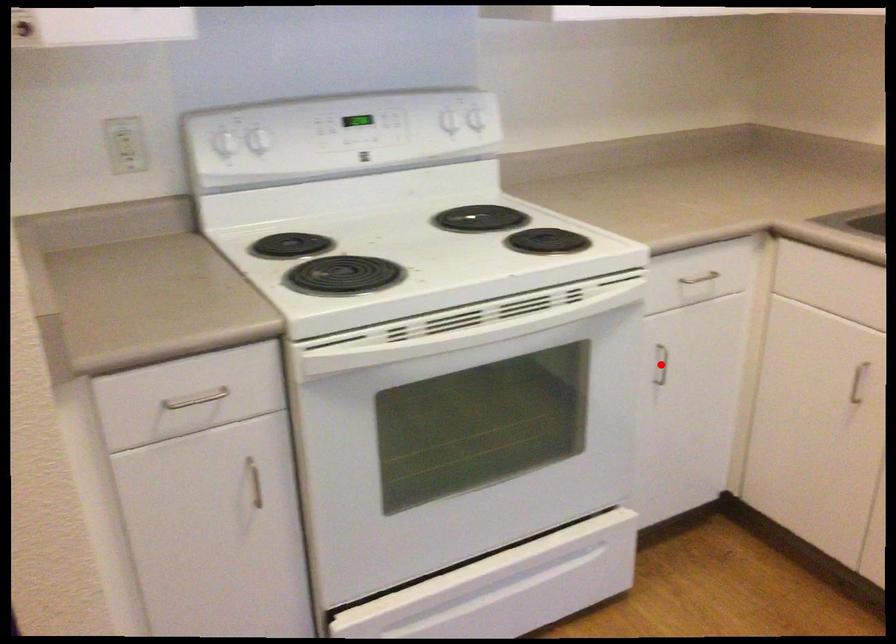
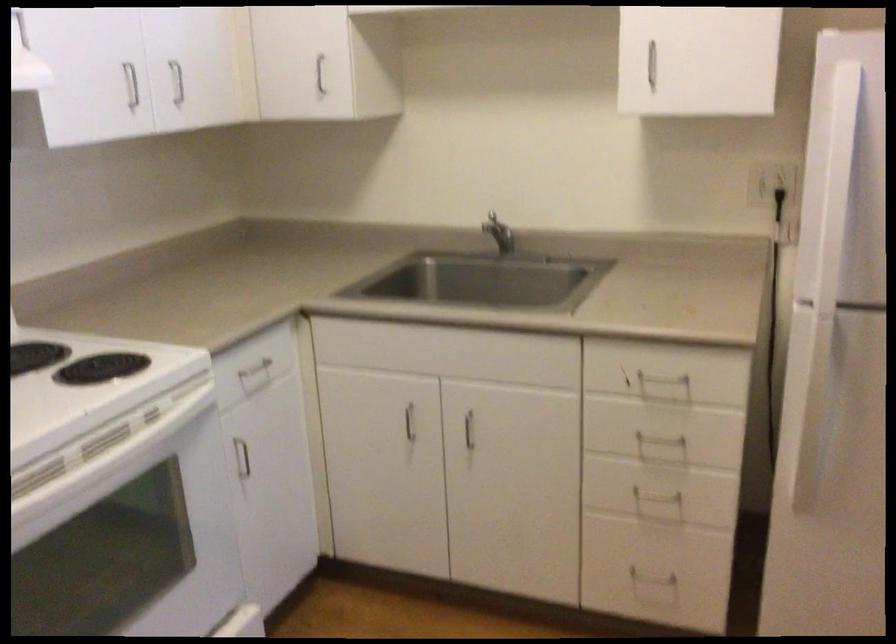
Locate, in the second image, the point that corresponds to the highlighted location in the first image.

(242, 458)